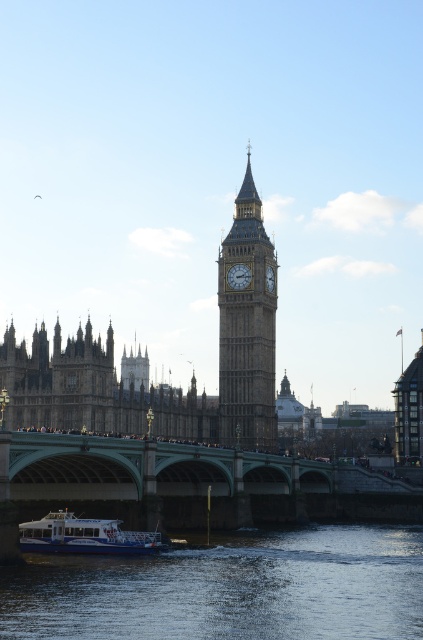
Question: Among these points, which one is farthest from the camera?

Choices:
 (A) (112, 541)
 (B) (238, 285)

Answer: (B)

Question: Is blue water at lower center to the right of white glossy boat at lower left from the viewer's perspective?

Choices:
 (A) yes
 (B) no

Answer: (A)

Question: Which point is farther to the camera?

Choices:
 (A) golden stone clock tower at center
 (B) white glossy boat at lower left
 (C) matte gold clock at center

Answer: (C)

Question: From the image, what is the correct spatial relationship of blue water at lower center in relation to golden stone clock tower at center?

Choices:
 (A) left
 (B) right

Answer: (B)

Question: Considering the relative positions of golden stone clock tower at center and white glossy boat at lower left in the image provided, where is golden stone clock tower at center located with respect to white glossy boat at lower left?

Choices:
 (A) right
 (B) left

Answer: (A)

Question: Among these objects, which one is farthest from the camera?

Choices:
 (A) matte gold clock at center
 (B) blue water at lower center
 (C) white glossy boat at lower left
 (D) golden stone clock tower at center

Answer: (A)